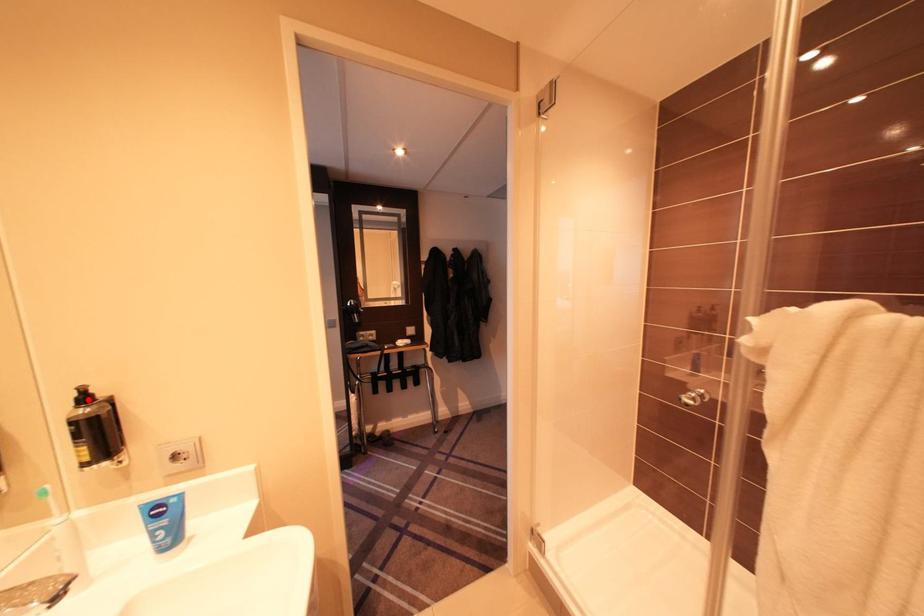
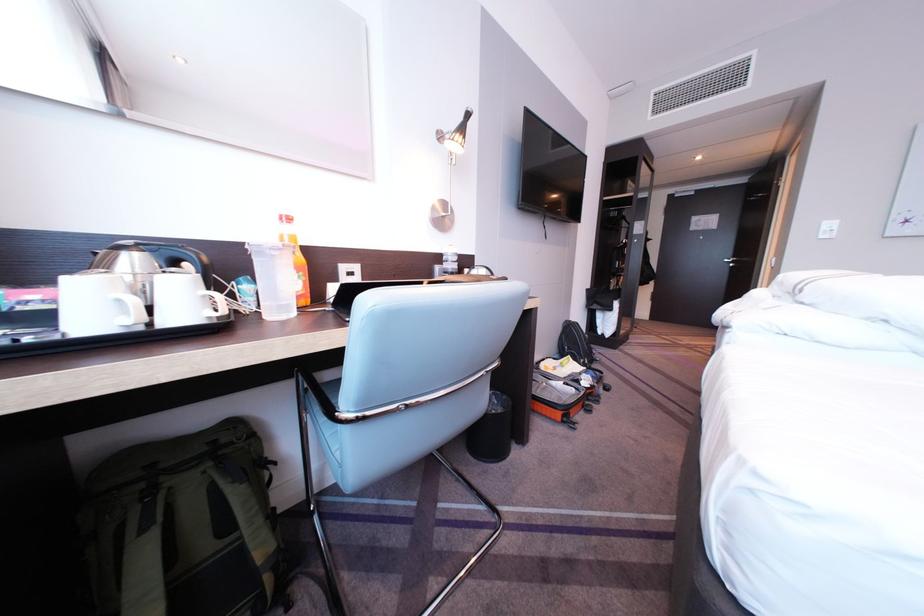
Question: I am providing you with two images of the same scene from different viewpoints. A red point is marked on the first image. Is the red point's position out of view in image 2?

Choices:
 (A) Yes
 (B) No

Answer: (A)